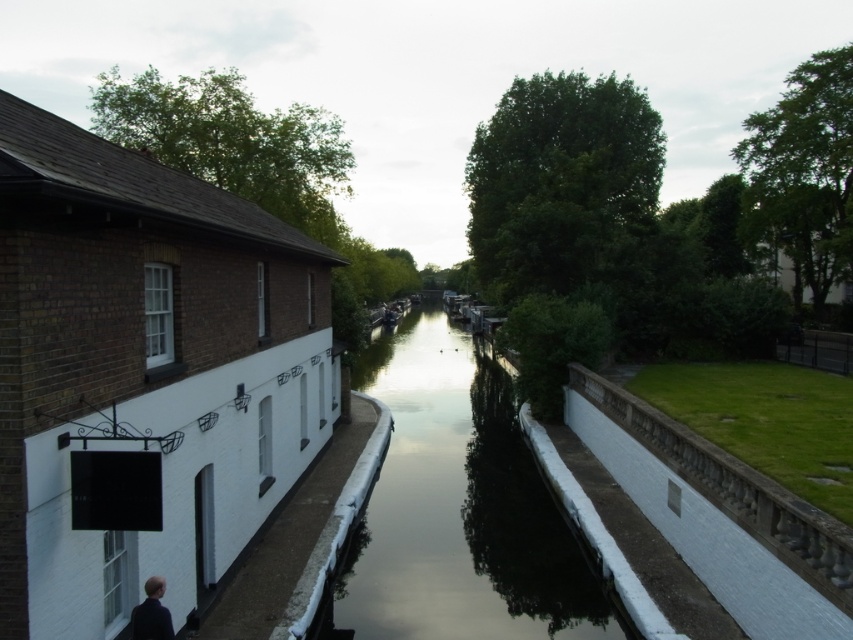
Who is positioned more to the left, smooth concrete canal at center or dark blue fabric person at lower left?

Positioned to the left is dark blue fabric person at lower left.

The height and width of the screenshot is (640, 853). What do you see at coordinates (459, 506) in the screenshot?
I see `smooth concrete canal at center` at bounding box center [459, 506].

Who is more forward, (527, 502) or (160, 595)?

Point (160, 595)

I want to click on smooth concrete canal at center, so click(x=459, y=506).